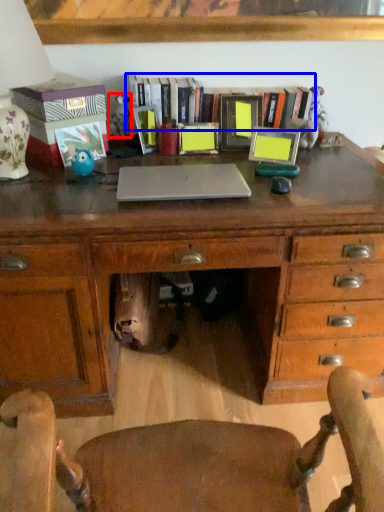
Question: Which object appears closest to the camera in this image, toy (highlighted by a red box) or book (highlighted by a blue box)?

Choices:
 (A) toy
 (B) book

Answer: (B)